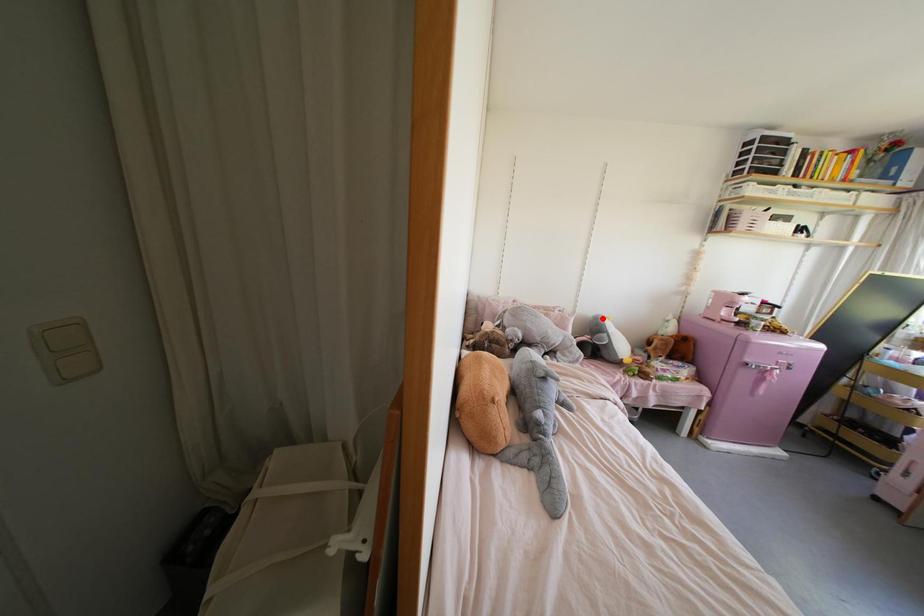
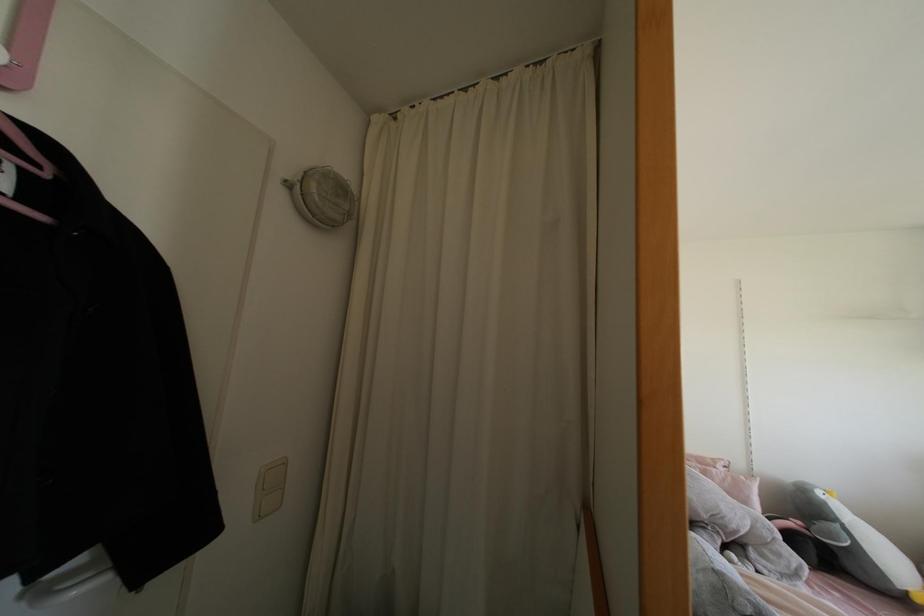
Question: I am providing you with two images of the same scene from different viewpoints. Image1 has a red point marked. In image2, the corresponding 3D location appears at what relative position? Reply with the corresponding letter.

Choices:
 (A) Closer
 (B) Farther

Answer: (A)